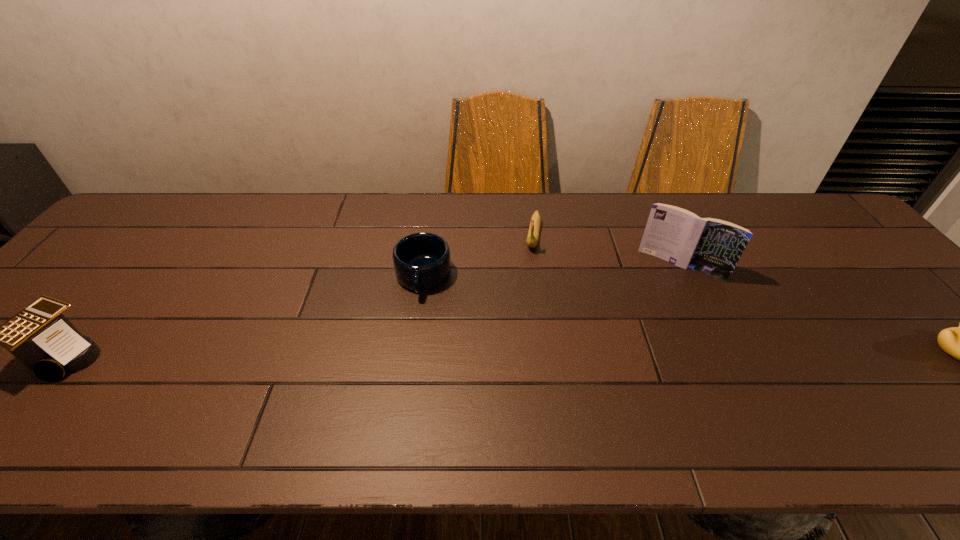
I want to click on vacant space at the near edge of the desktop, so click(x=574, y=372).

The height and width of the screenshot is (540, 960). In the image, there is a desktop. Find the location of `vacant region at the right edge`. vacant region at the right edge is located at coordinates (870, 277).

This screenshot has height=540, width=960. Find the location of `free point at the far left corner`. free point at the far left corner is located at coordinates (160, 202).

The image size is (960, 540). I want to click on free point between the second object from right to left and the banana, so click(x=607, y=251).

Locate an element on the screen. free spot between the calculator and the book is located at coordinates (374, 310).

Where is `empty location between the book and the second object from left to right`? The image size is (960, 540). empty location between the book and the second object from left to right is located at coordinates (552, 272).

You are a GUI agent. You are given a task and a screenshot of the screen. Output one action in this format:
    pyautogui.click(x=<x>, y=<y>)
    Task: Click on the vacant region between the fourth object from right to left and the leftmost object
    Image resolution: width=960 pixels, height=540 pixels.
    Given the screenshot: What is the action you would take?
    pyautogui.click(x=246, y=316)

Where is `vacant space that's between the leftmost object and the tallest object`? Image resolution: width=960 pixels, height=540 pixels. vacant space that's between the leftmost object and the tallest object is located at coordinates (374, 310).

You are a GUI agent. You are given a task and a screenshot of the screen. Output one action in this format:
    pyautogui.click(x=<x>, y=<y>)
    Task: Click on the object that ranks as the third closest to the rightmost object
    This screenshot has width=960, height=540.
    Given the screenshot: What is the action you would take?
    pyautogui.click(x=421, y=260)

Identify the location of object identified as the second closest to the calculator. (533, 234).